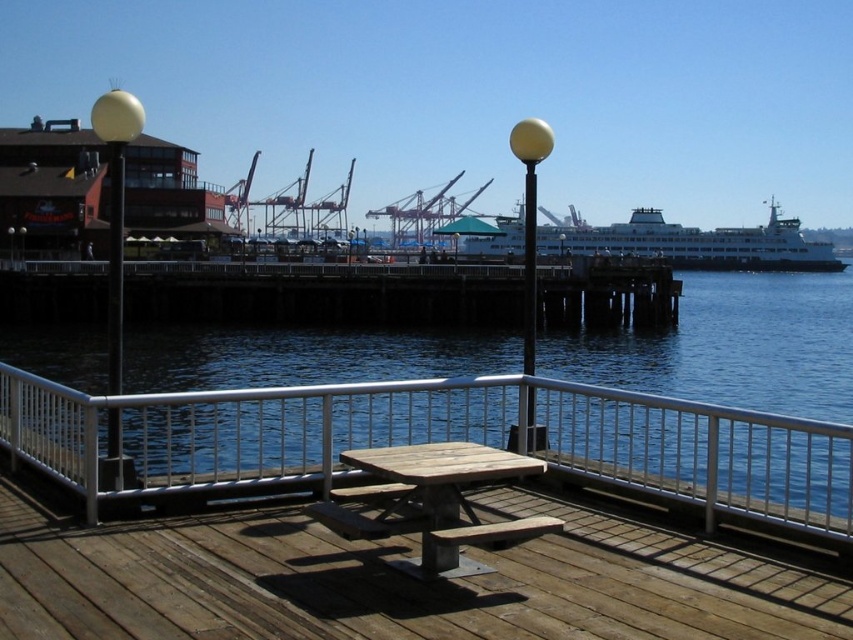
You are standing on the wooden deck and want to place a small potted plant between the white metal railing at center and the wooden picnic table at center. Based on their positions, where should you place the plant?

The white metal railing at center is located below the wooden picnic table at center, so you should place the plant between them at the lower area near the railing.